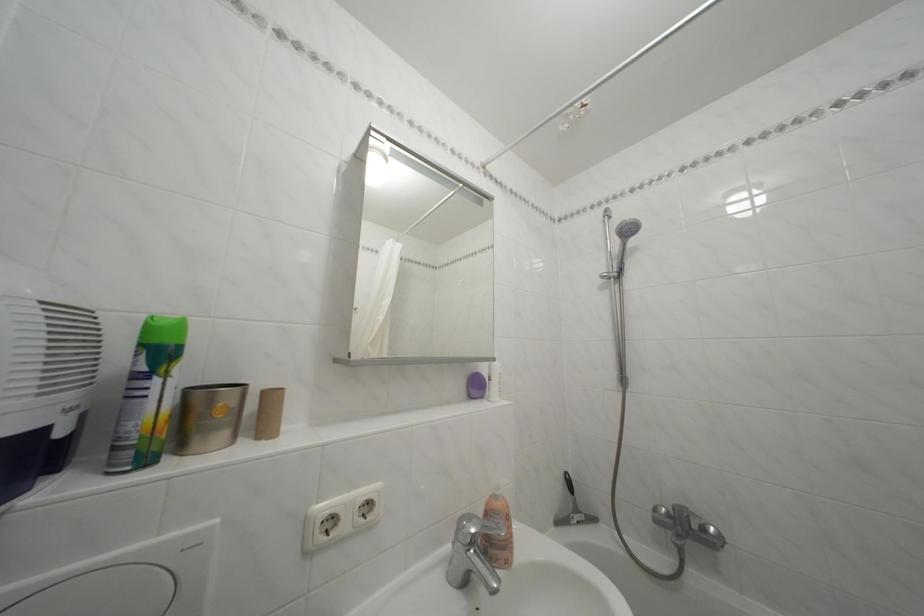
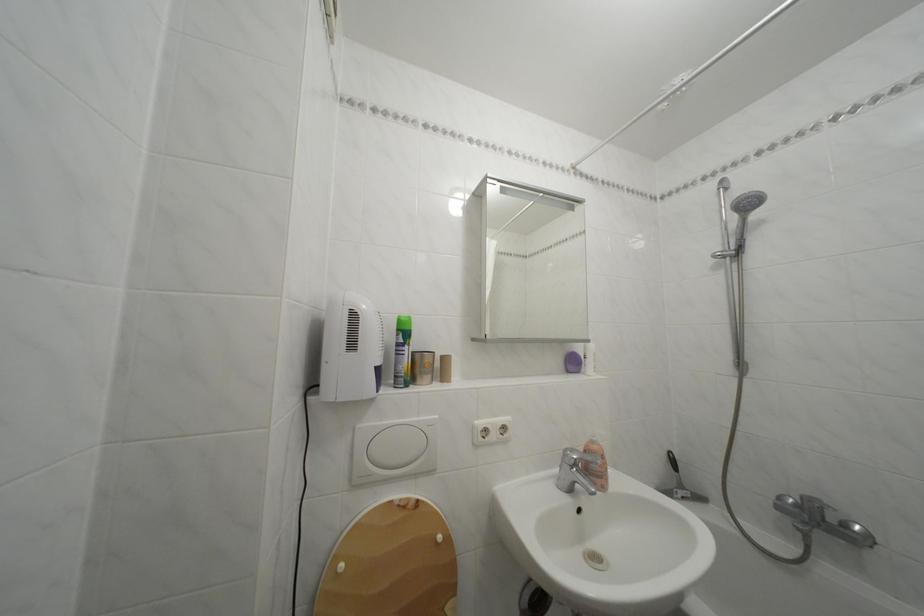
The point at (586, 517) is marked in the first image. Where is the corresponding point in the second image?

(689, 492)